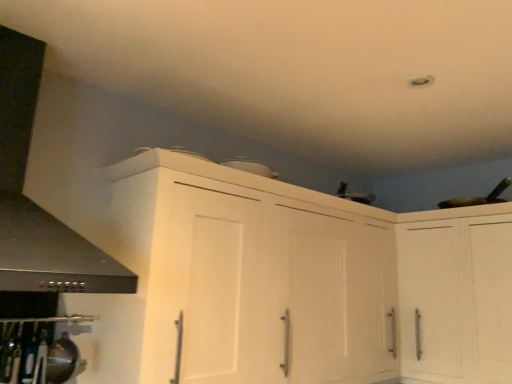
Identify the location of empty space that is ontop of black matte exhaust hood at left (from a real-world perspective). (73, 28).